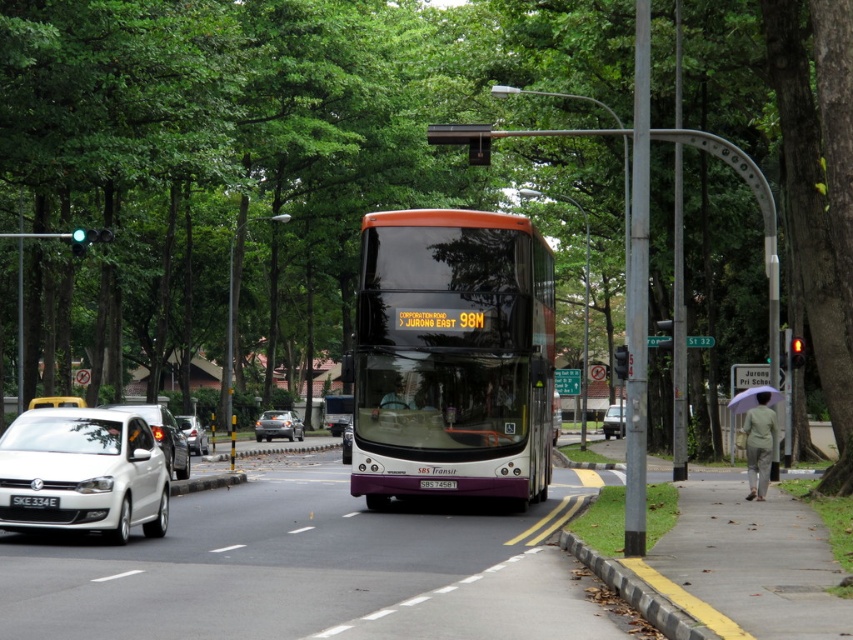
Question: Which point is farther to the camera?

Choices:
 (A) (612, 432)
 (B) (192, 448)

Answer: (A)

Question: Is white glossy sedan at left further to the viewer compared to white matte sedan at center?

Choices:
 (A) no
 (B) yes

Answer: (A)

Question: Can you confirm if shiny silver sedan at center is positioned above black plastic license plate at center?

Choices:
 (A) yes
 (B) no

Answer: (B)

Question: Is yellow rubber curb at lower center below silver metallic sedan at center-left?

Choices:
 (A) no
 (B) yes

Answer: (A)

Question: Which of these objects is positioned closest to the black plastic license plate at center?

Choices:
 (A) yellow rubber curb at lower center
 (B) matte purple bus at center

Answer: (A)

Question: Which point is farther to the camera?

Choices:
 (A) matte purple bus at center
 (B) black plastic license plate at center
 (C) yellow rubber curb at lower center

Answer: (A)